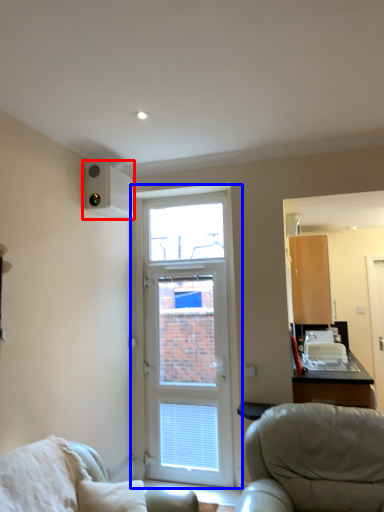
Question: Which object is further to the camera taking this photo, air conditioning (highlighted by a red box) or door (highlighted by a blue box)?

Choices:
 (A) air conditioning
 (B) door

Answer: (B)